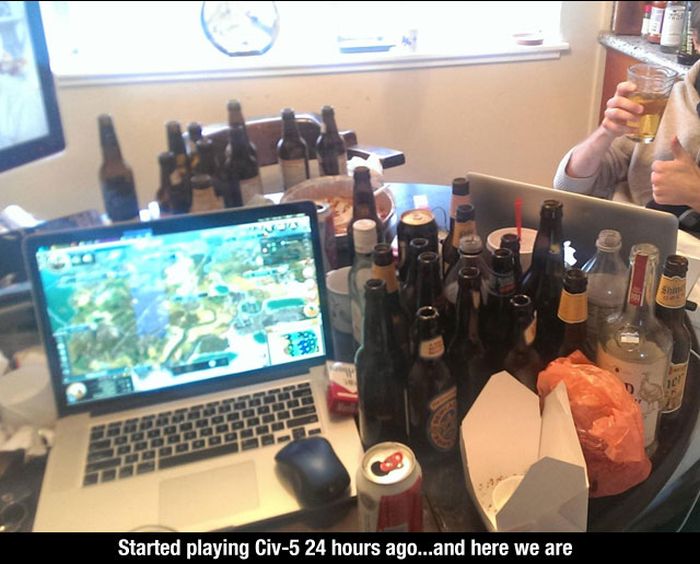
Where is `screen`? The width and height of the screenshot is (700, 564). screen is located at coordinates [x=185, y=296].